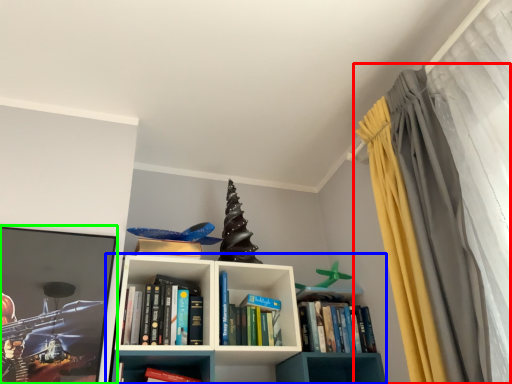
Question: Which is farther away from curtain (highlighted by a red box)? shelf (highlighted by a blue box) or picture frame (highlighted by a green box)?

Choices:
 (A) shelf
 (B) picture frame

Answer: (B)